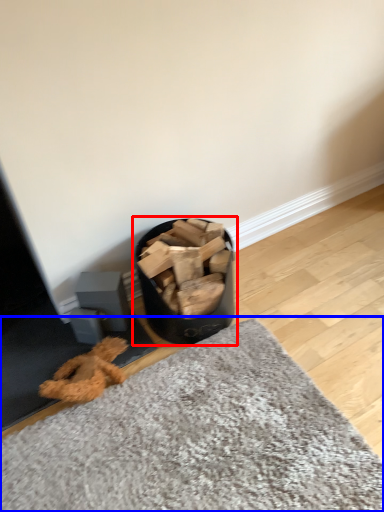
Question: Which object is closer to the camera taking this photo, waste container (highlighted by a red box) or mat (highlighted by a blue box)?

Choices:
 (A) waste container
 (B) mat

Answer: (B)